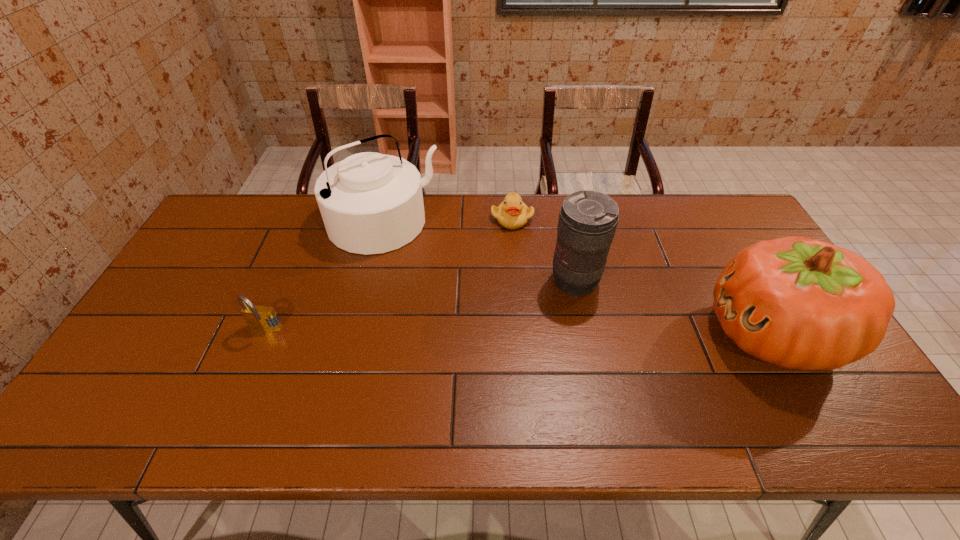
You are a GUI agent. You are given a task and a screenshot of the screen. Output one action in this format:
    pyautogui.click(x=<x>, y=<y>)
    Task: Click on the free space at the near right corner of the desktop
    
    Given the screenshot: What is the action you would take?
    pyautogui.click(x=811, y=375)

This screenshot has height=540, width=960. What are the coordinates of `vacant area that lies between the padlock and the kettle` in the screenshot? It's located at (324, 276).

This screenshot has height=540, width=960. In order to click on free area in between the rightmost object and the telephoto lens in this screenshot , I will do 674,308.

I want to click on vacant area that lies between the rightmost object and the fourth object from left to right, so click(674, 308).

This screenshot has height=540, width=960. I want to click on empty location between the fourth object from left to right and the rightmost object, so click(x=674, y=308).

The width and height of the screenshot is (960, 540). Identify the location of blank region between the kettle and the telephoto lens. pos(479,252).

Where is `free spot between the kettle and the fourth tallest object`? The height and width of the screenshot is (540, 960). free spot between the kettle and the fourth tallest object is located at coordinates (324, 276).

Identify the location of empty space that is in between the pumpkin and the shortest object. This screenshot has width=960, height=540. (642, 276).

Identify the location of free space between the fourth tallest object and the pumpkin. The image size is (960, 540). (519, 332).

Locate an element on the screen. vacant point located between the duckling and the leftmost object is located at coordinates point(389,274).